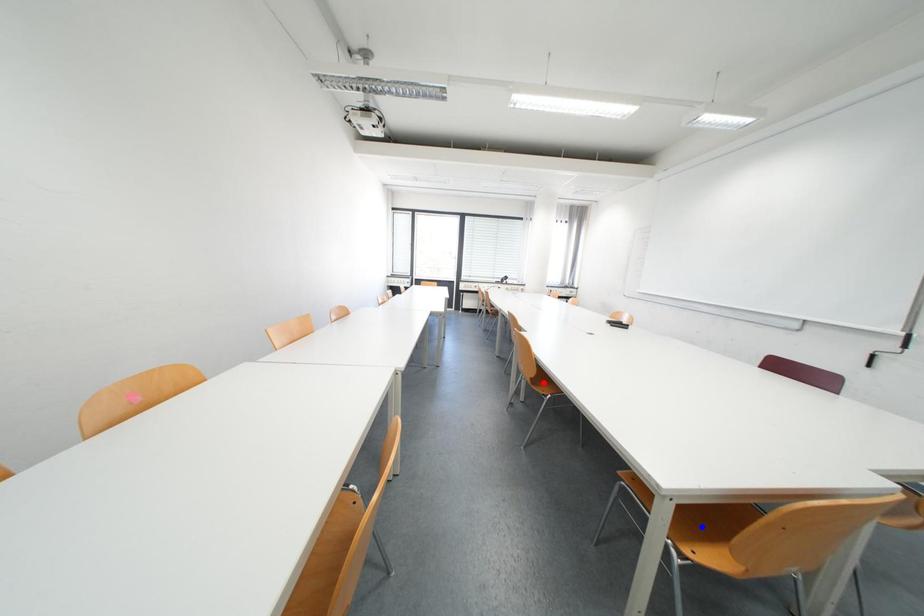
Question: Two points are marked on the image. Which point is closer to the camera?

Choices:
 (A) Blue point is closer.
 (B) Red point is closer.

Answer: (A)